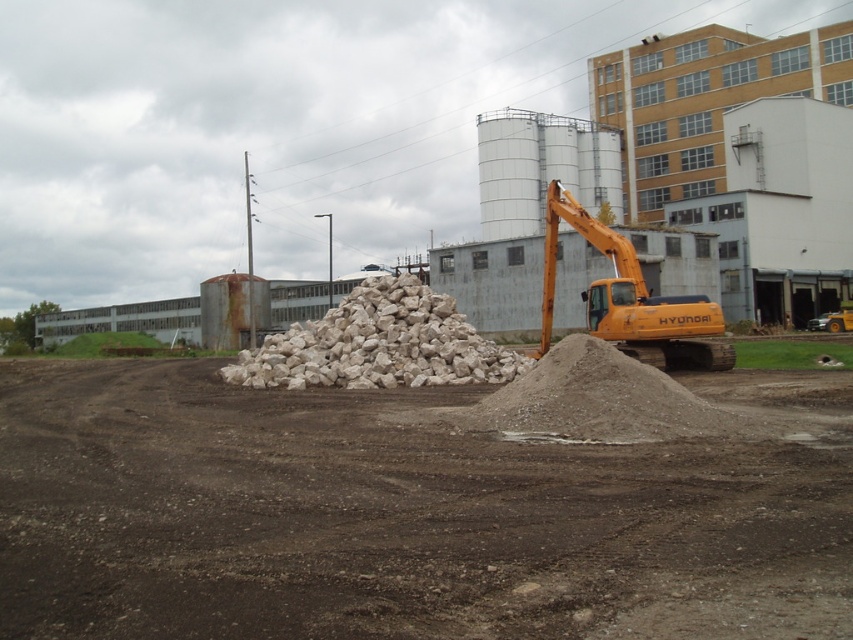
Can you confirm if brown/dry soil at center is positioned above white rough stone at center?

Actually, brown/dry soil at center is below white rough stone at center.

Is point (129, 378) closer to viewer compared to point (314, 358)?

No, it is not.

Where is `brown/dry soil at center`? brown/dry soil at center is located at coordinates (390, 518).

Based on the photo, which is below, brown/dry soil at center or orange metallic excavator at center-right?

brown/dry soil at center is lower down.

Image resolution: width=853 pixels, height=640 pixels. What do you see at coordinates (390, 518) in the screenshot? I see `brown/dry soil at center` at bounding box center [390, 518].

Find the location of `brown/dry soil at center`. brown/dry soil at center is located at coordinates (390, 518).

Locate an element on the screen. This screenshot has height=640, width=853. brown/dry soil at center is located at coordinates (390, 518).

Can you confirm if white rough stone at center is positioned to the left of orange metallic excavator at center-right?

Indeed, white rough stone at center is positioned on the left side of orange metallic excavator at center-right.

Based on the photo, who is positioned more to the left, white rough stone at center or orange metallic excavator at center-right?

From the viewer's perspective, white rough stone at center appears more on the left side.

Is point (340, 340) positioned behind point (637, 280)?

No, it is not.

Identify the location of white rough stone at center. (378, 344).